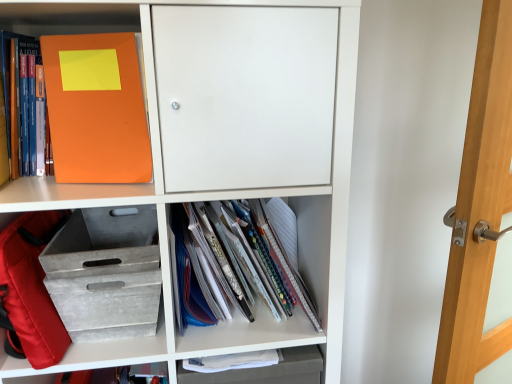
Question: From a real-world perspective, is orange matte folder at upper left, the first shelf when ordered from top to bottom, positioned above or below transparent glass door at right?

Choices:
 (A) below
 (B) above

Answer: (B)

Question: Is orange matte folder at upper left, positioned as the 3th shelf in bottom-to-top order, taller or shorter than transparent glass door at right?

Choices:
 (A) tall
 (B) short

Answer: (B)

Question: Estimate the real-world distances between objects in this image. Which object is farther from the orange matte folder at upper left, placed as the second shelf when sorted from top to bottom?

Choices:
 (A) red fabric backpack at lower left
 (B) orange matte folder at upper left, arranged as the 1th book when viewed from the left
 (C) white paper notebook at center, which is the second book in top-to-bottom order
 (D) transparent glass door at right
 (E) gray textured crate at lower left, arranged as the 3th shelf when viewed from the top

Answer: (B)

Question: Which object is positioned farthest from the white paper notebook at center, which is counted as the 1th book, starting from the right?

Choices:
 (A) gray textured crate at lower left, acting as the 1th shelf starting from the bottom
 (B) orange matte folder at upper left, placed as the second book when sorted from right to left
 (C) orange matte folder at upper left, positioned as the 3th shelf in bottom-to-top order
 (D) red fabric backpack at lower left
 (E) transparent glass door at right

Answer: (B)